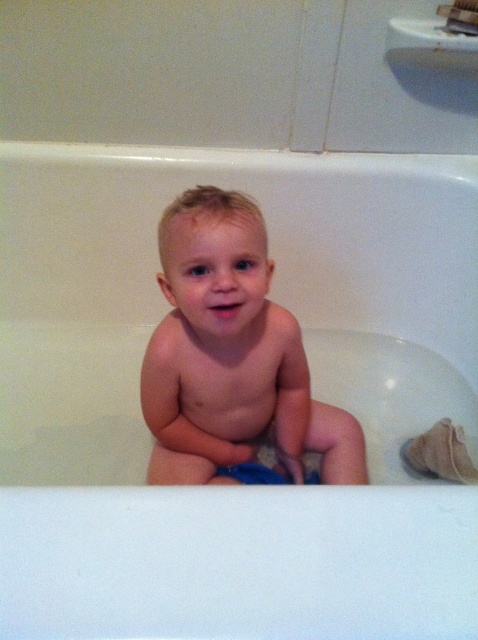
You are a photographer taking a picture of a baby in a bathtub. You need to ensure the blue fabric diaper at center does not cover the smooth skin baby at center. Based on their sizes, is this possible?

The smooth skin baby at center has a greater height compared to the blue fabric diaper at center, so it is possible to position the diaper in a way that it does not cover the baby.

You are a photographer taking a picture of the smooth skin baby at center and the blue fabric diaper at center in the bathtub. To ensure both are clearly visible, where should you position the flash? Should it be to the left or right of the baby?

The smooth skin baby at center is positioned on the left side of blue fabric diaper at center. To ensure both are clearly visible, the flash should be positioned to the right of the baby so that the light reaches both the baby and the diaper without casting shadows over them.

You are a photographer positioned at the center of the bathroom. You want to take a closeup shot of the smooth skin baby at center. According to the coordinates provided, where should you aim your camera to capture the baby perfectly?

The smooth skin baby at center is located at coordinates point (x=230, y=355), so you should aim your camera at that specific point to capture the baby perfectly.